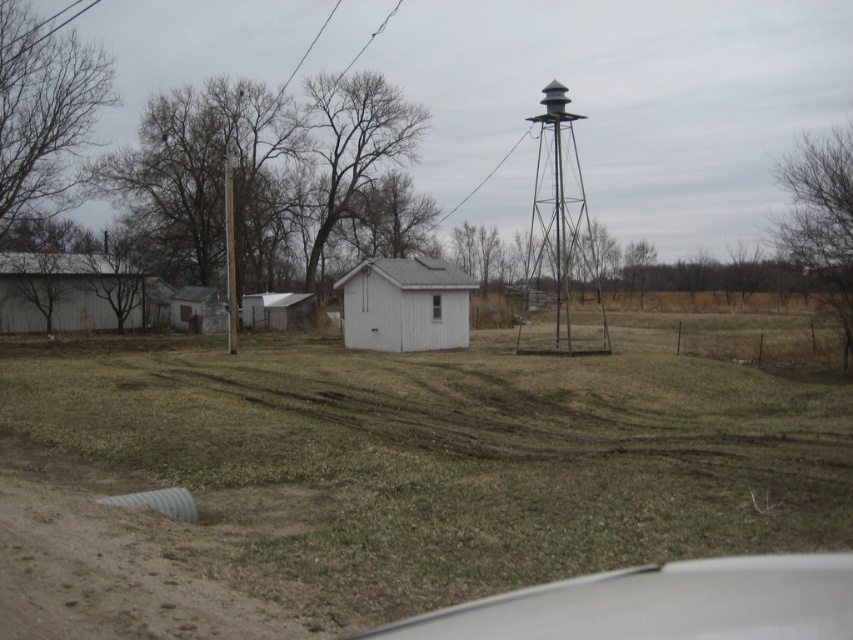
Can you confirm if green grass at center is shorter than metallic gray water tower at right?

Indeed, green grass at center has a lesser height compared to metallic gray water tower at right.

Is green grass at center wider than metallic gray water tower at right?

Yes.

Is point (167, 401) farther from viewer compared to point (567, 326)?

No, it is in front of (567, 326).

This screenshot has width=853, height=640. Identify the location of green grass at center. (439, 460).

Does white glossy car window at lower center have a greater width compared to white wood shed at center?

No.

From the picture: Can you confirm if white glossy car window at lower center is positioned to the right of white wood shed at center?

Indeed, white glossy car window at lower center is positioned on the right side of white wood shed at center.

Identify the location of white glossy car window at lower center. (660, 604).

Is metallic gray water tower at right smaller than white wood shed at center?

Incorrect, metallic gray water tower at right is not smaller in size than white wood shed at center.

Which of these two, metallic gray water tower at right or white wood shed at center, stands taller?

metallic gray water tower at right

Identify the location of metallic gray water tower at right. The height and width of the screenshot is (640, 853). pyautogui.click(x=560, y=236).